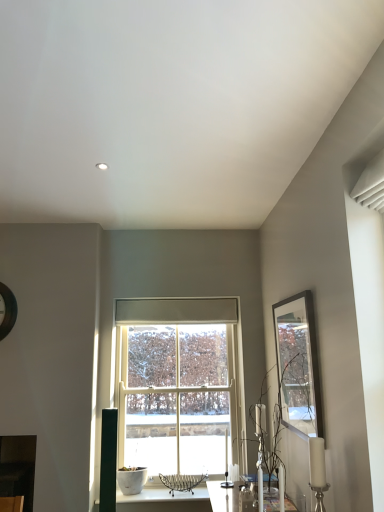
Question: Looking at their shapes, would you say translucent glass vase at right is wider or thinner than matte black picture frame at upper right?

Choices:
 (A) wide
 (B) thin

Answer: (A)

Question: From a real-world perspective, is translucent glass vase at right physically located above or below matte black picture frame at upper right?

Choices:
 (A) below
 (B) above

Answer: (A)

Question: Estimate the real-world distances between objects in this image. Which object is closer to the translucent glass vase at right?

Choices:
 (A) matte black picture frame at upper right
 (B) white wooden window at center

Answer: (A)

Question: Which of these objects is positioned farthest from the white wooden window at center?

Choices:
 (A) translucent glass vase at right
 (B) matte black picture frame at upper right

Answer: (B)